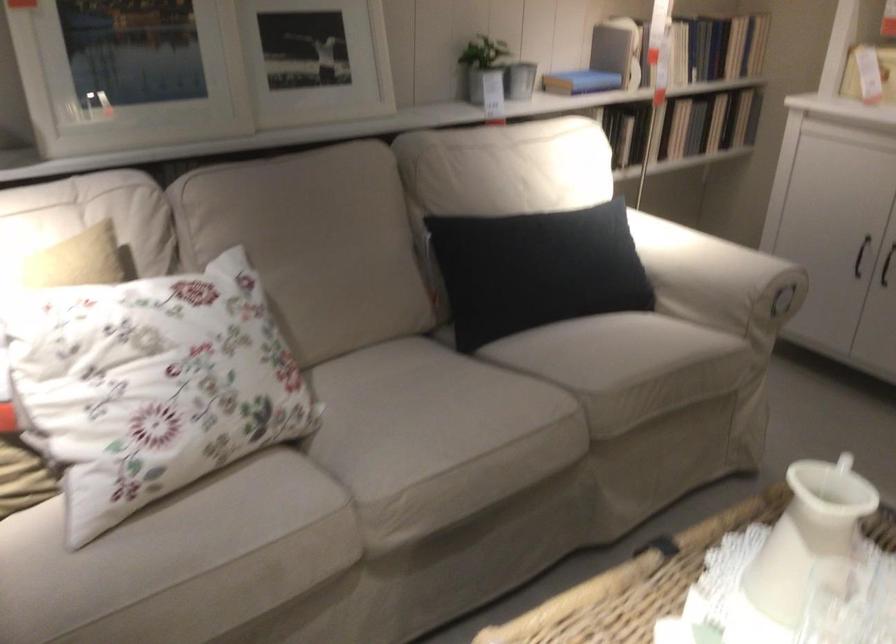
What do you see at coordinates (398, 494) in the screenshot?
I see `the beige sofa sitting surface` at bounding box center [398, 494].